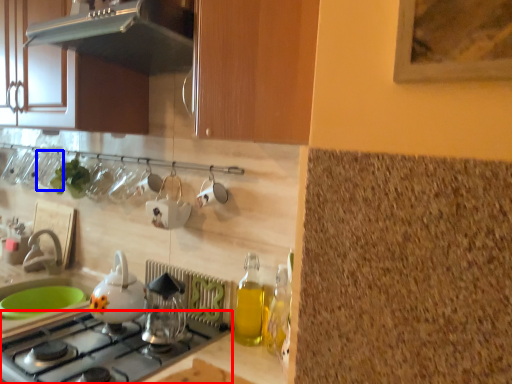
Question: Among these objects, which one is nearest to the camera, gas stove (highlighted by a red box) or tableware (highlighted by a blue box)?

Choices:
 (A) gas stove
 (B) tableware

Answer: (A)